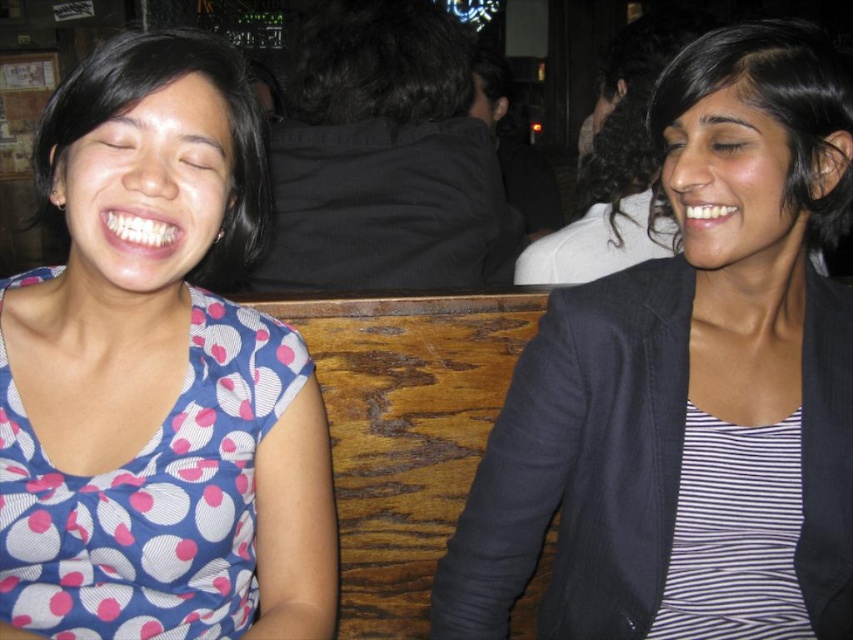
How distant is striped fabric at center from blue dotted fabric shirt at left?

striped fabric at center and blue dotted fabric shirt at left are 16.87 inches apart from each other.

In the scene shown: Is striped fabric at center in front of blue dotted fabric shirt at left?

No, striped fabric at center is further to the viewer.

Between point (764, 269) and point (289, 561), which one is positioned behind?

Point (764, 269)

Find the location of a particular element. This screenshot has width=853, height=640. striped fabric at center is located at coordinates (689, 387).